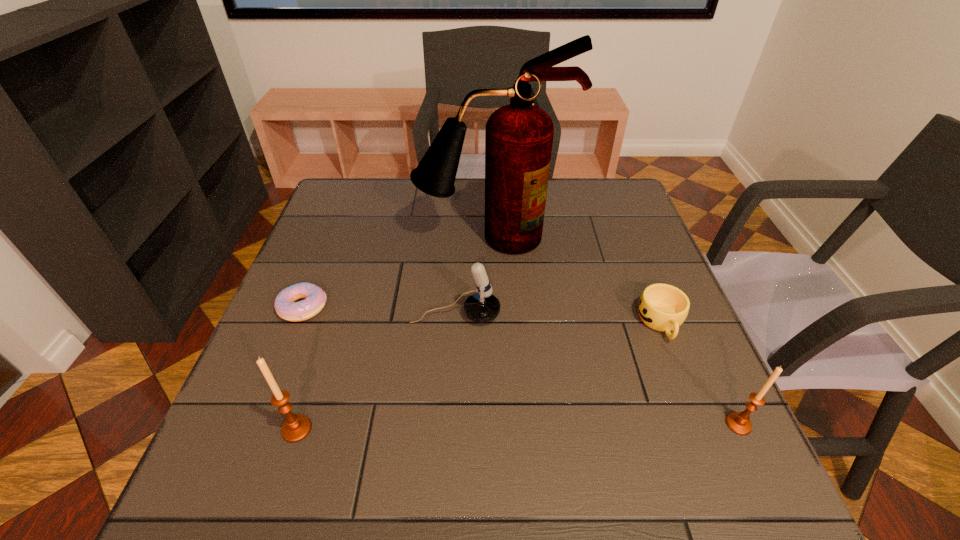
Please point a space for a new candle_holder to maintain equal intervals. Please provide its 2D coordinates. Your answer should be formatted as a tuple, i.e. [(x, y)], where the tuple contains the x and y coordinates of a point satisfying the conditions above.

[(518, 427)]